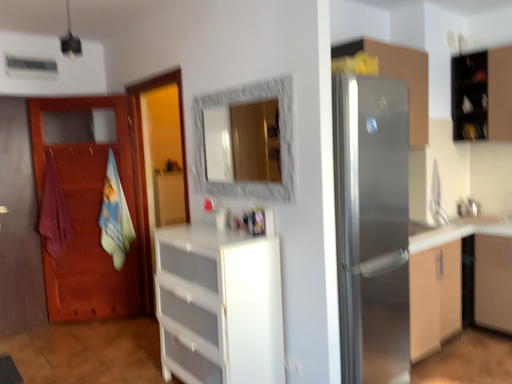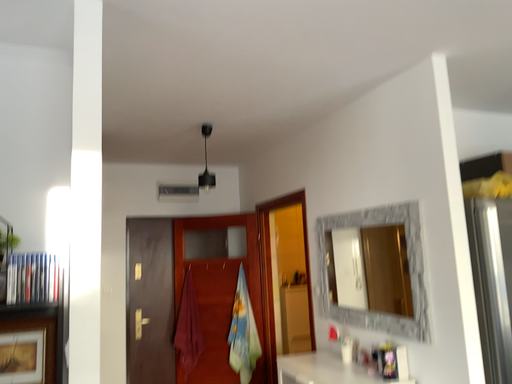
Question: How did the camera likely rotate when shooting the video?

Choices:
 (A) rotated right
 (B) rotated left

Answer: (B)